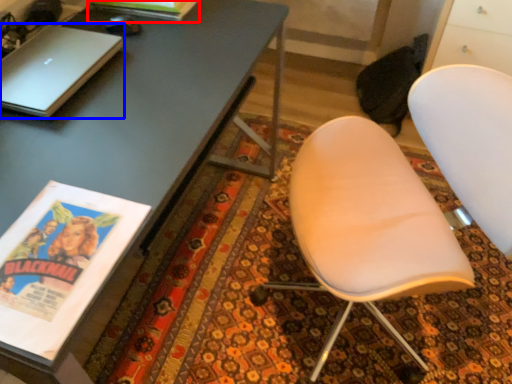
Question: Among these objects, which one is farthest to the camera, magazine (highlighted by a red box) or laptop (highlighted by a blue box)?

Choices:
 (A) magazine
 (B) laptop

Answer: (A)